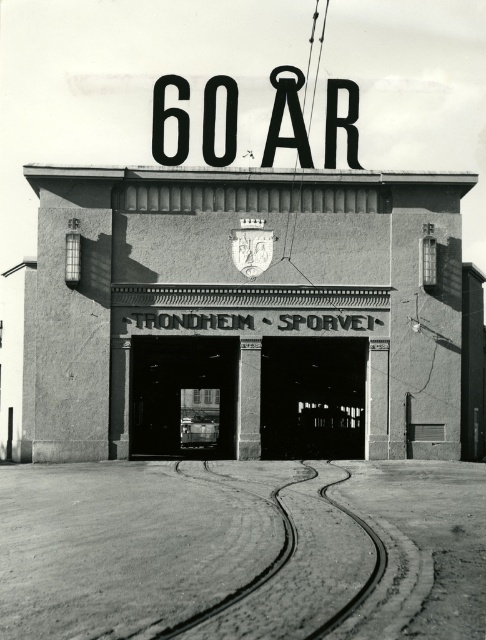
Is point (249, 355) farther from viewer compared to point (202, 152)?

No, (249, 355) is in front of (202, 152).

Based on the photo, does concrete textured building at center appear under black metal sign at upper center?

Yes.

Does point (427, 195) come in front of point (170, 109)?

Yes, point (427, 195) is closer to viewer.

Identify the location of concrete textured building at center. This screenshot has width=486, height=640. (245, 305).